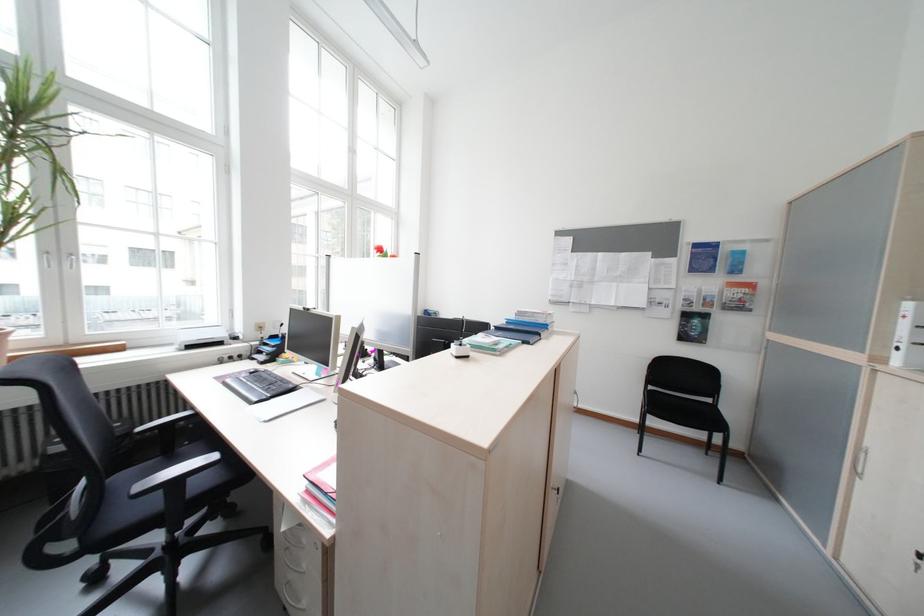
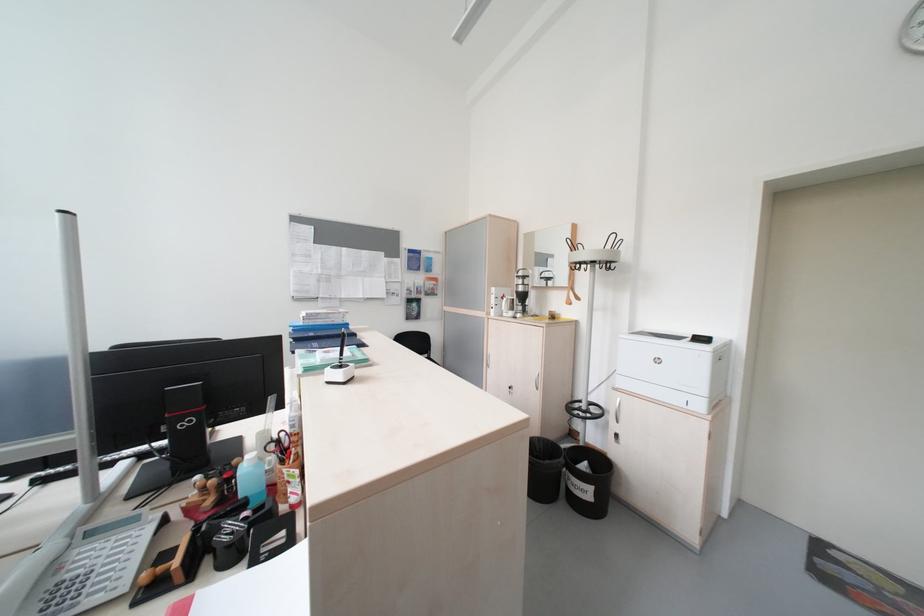
Question: The camera is either moving clockwise (left) or counter-clockwise (right) around the object. The first image is from the beginning of the video and the second image is from the end. Is the camera moving left or right when shooting the video?

Choices:
 (A) Left
 (B) Right

Answer: (A)